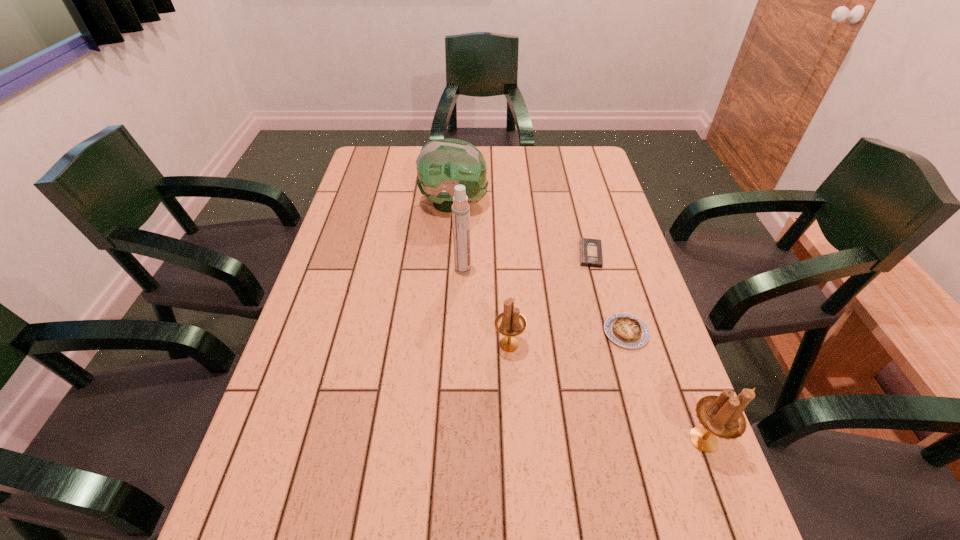
I want to click on blank space at the near edge of the desktop, so click(387, 467).

Where is `vacant space at the left edge of the desktop`? vacant space at the left edge of the desktop is located at coordinates (305, 388).

In the image, there is a desktop. Where is `blank space at the right edge`? The height and width of the screenshot is (540, 960). blank space at the right edge is located at coordinates (592, 217).

Find the location of `vacant region at the far left corner of the desktop`. vacant region at the far left corner of the desktop is located at coordinates click(371, 180).

Locate an element on the screen. vacant area at the near left corner of the desktop is located at coordinates (249, 497).

The width and height of the screenshot is (960, 540). In order to click on free space at the far right corner of the desktop in this screenshot , I will do `click(585, 157)`.

Find the location of a particular element. vacant area at the near right corner is located at coordinates (725, 500).

Identify the location of free space that is in between the shortest object and the tallest object. (527, 262).

This screenshot has height=540, width=960. In order to click on free point between the farther candle holder and the tallest object in this screenshot , I will do `click(486, 307)`.

Identify the location of unoccupied position between the nearest object and the tallest object. The width and height of the screenshot is (960, 540). (583, 354).